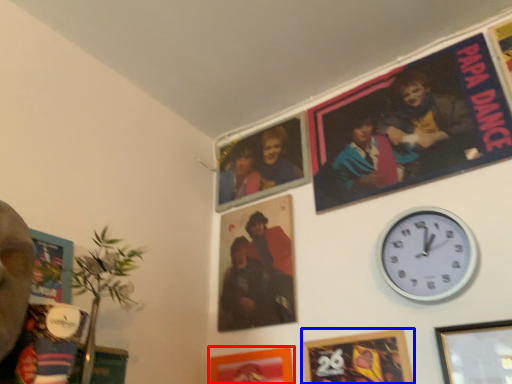
Question: Among these objects, which one is farthest to the camera, picture frame (highlighted by a red box) or picture frame (highlighted by a blue box)?

Choices:
 (A) picture frame
 (B) picture frame

Answer: (A)